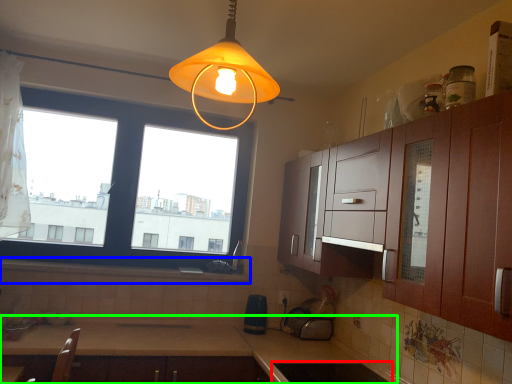
Question: Considering the real-world distances, which object is farthest from appliance (highlighted by a red box)? window sill (highlighted by a blue box) or countertop (highlighted by a green box)?

Choices:
 (A) window sill
 (B) countertop

Answer: (A)